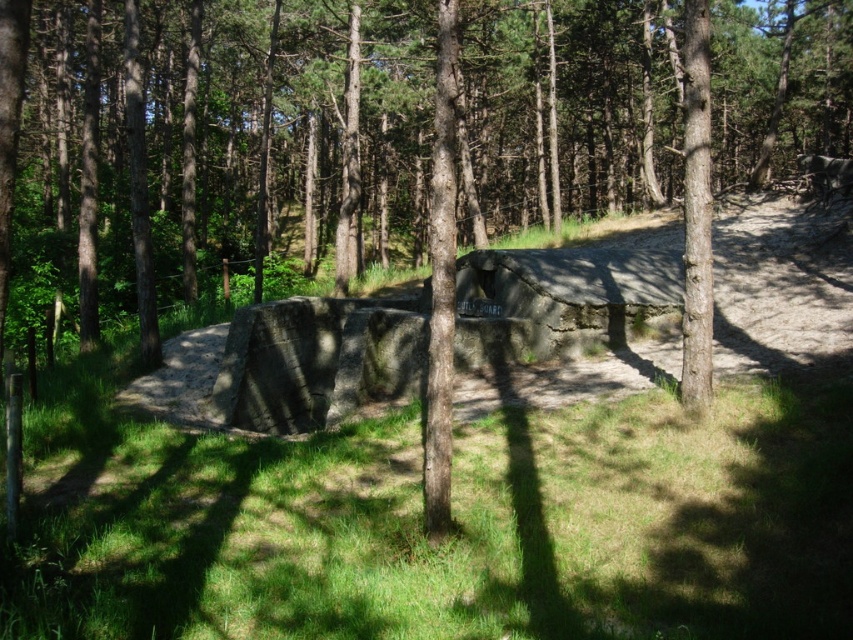
You are standing in the forest and need to locate the green grass at center. Based on the scene description, which direction should you look relative to the brown rough tree at center?

The green grass at center is to the right of the brown rough tree at center.

You are a park ranger assessing the forest area. You notice the brown rough tree at center and the green grass at center. Which object has a greater width?

The brown rough tree at center has a greater width than the green grass at center according to the description.